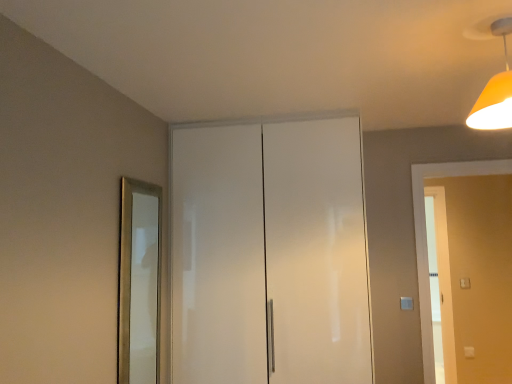
Describe the element at coordinates (269, 253) in the screenshot. Image resolution: width=512 pixels, height=384 pixels. I see `white glossy cabinet at center` at that location.

Image resolution: width=512 pixels, height=384 pixels. What are the coordinates of `white glossy door at right` in the screenshot? It's located at (426, 237).

Where is `orange matte light fixture at upper right`? The height and width of the screenshot is (384, 512). orange matte light fixture at upper right is located at coordinates (495, 90).

Is orange matte light fixture at upper right spatially inside white glossy cabinet at center, or outside of it?

orange matte light fixture at upper right is spatially situated outside white glossy cabinet at center.

Is orange matte light fixture at upper right placed right next to white glossy cabinet at center?

orange matte light fixture at upper right and white glossy cabinet at center are not in contact.

Does point (505, 59) appear closer or farther from the camera than point (187, 318)?

Point (505, 59) appears to be closer to the viewer than point (187, 318).

From a real-world perspective, relative to orange matte light fixture at upper right, is white glossy cabinet at center vertically above or below?

white glossy cabinet at center is below orange matte light fixture at upper right.

In the scene shown: Is white glossy cabinet at center not inside orange matte light fixture at upper right?

white glossy cabinet at center is positioned outside orange matte light fixture at upper right.

Can you confirm if white glossy cabinet at center is positioned to the left of orange matte light fixture at upper right?

Yes, white glossy cabinet at center is to the left of orange matte light fixture at upper right.

Is white glossy cabinet at center turned away from gold metallic mirror at left?

No, white glossy cabinet at center is not facing the opposite direction of gold metallic mirror at left.

Which of these two, white glossy cabinet at center or gold metallic mirror at left, is wider?

white glossy cabinet at center is wider.

Which is correct: white glossy cabinet at center is inside gold metallic mirror at left, or outside of it?

white glossy cabinet at center cannot be found inside gold metallic mirror at left.

Is point (497, 81) positioned before point (452, 173)?

Yes, point (497, 81) is closer to viewer.

Which is more to the left, orange matte light fixture at upper right or white glossy door at right?

orange matte light fixture at upper right is more to the left.

From a real-world perspective, between orange matte light fixture at upper right and white glossy door at right, who is vertically lower?

white glossy door at right, from a real-world perspective.

From the image's perspective, between orange matte light fixture at upper right and white glossy door at right, which one is located above?

orange matte light fixture at upper right, from the image's perspective.

Would you consider white glossy cabinet at center to be distant from white glossy door at right?

Yes, white glossy cabinet at center is far from white glossy door at right.

From the image's perspective, is white glossy cabinet at center located above or below white glossy door at right?

white glossy cabinet at center is situated higher than white glossy door at right in the image.

Would you say white glossy cabinet at center is inside or outside white glossy door at right?

A: white glossy cabinet at center cannot be found inside white glossy door at right.

Considering the sizes of objects orange matte light fixture at upper right and gold metallic mirror at left in the image provided, who is bigger, orange matte light fixture at upper right or gold metallic mirror at left?

Bigger between the two is gold metallic mirror at left.

Considering the relative sizes of orange matte light fixture at upper right and gold metallic mirror at left in the image provided, is orange matte light fixture at upper right thinner than gold metallic mirror at left?

Incorrect, the width of orange matte light fixture at upper right is not less than that of gold metallic mirror at left.

From a real-world perspective, is orange matte light fixture at upper right physically located above or below gold metallic mirror at left?

From a real-world perspective, orange matte light fixture at upper right is physically above gold metallic mirror at left.

Which point is more forward, [490,126] or [147,191]?

The point [490,126] is closer to the camera.

Which is closer, (155, 203) or (203, 366)?

Point (203, 366)

Considering the sizes of objects gold metallic mirror at left and white glossy cabinet at center in the image provided, who is thinner, gold metallic mirror at left or white glossy cabinet at center?

gold metallic mirror at left.

Is there a large distance between gold metallic mirror at left and white glossy cabinet at center?

gold metallic mirror at left is near white glossy cabinet at center, not far away.

The height and width of the screenshot is (384, 512). Find the location of `dresser on the right of gold metallic mirror at left`. dresser on the right of gold metallic mirror at left is located at coordinates (269, 253).

The width and height of the screenshot is (512, 384). In order to click on light fixture above the white glossy cabinet at center (from a real-world perspective) in this screenshot , I will do `click(495, 90)`.

Image resolution: width=512 pixels, height=384 pixels. In order to click on dresser that appears behind the orange matte light fixture at upper right in this screenshot , I will do `click(269, 253)`.

Based on their spatial positions, is gold metallic mirror at left or white glossy door at right further from white glossy cabinet at center?

Among the two, white glossy door at right is located further to white glossy cabinet at center.

Looking at the image, which one is located closer to orange matte light fixture at upper right, white glossy door at right or gold metallic mirror at left?

white glossy door at right is positioned closer to the anchor orange matte light fixture at upper right.

From the image, which object appears to be farther from orange matte light fixture at upper right, white glossy cabinet at center or gold metallic mirror at left?

Among the two, gold metallic mirror at left is located further to orange matte light fixture at upper right.

Estimate the real-world distances between objects in this image. Which object is closer to orange matte light fixture at upper right, gold metallic mirror at left or white glossy door at right?

white glossy door at right is positioned closer to the anchor orange matte light fixture at upper right.

Which object lies nearer to the anchor point white glossy cabinet at center, white glossy door at right or gold metallic mirror at left?

Based on the image, gold metallic mirror at left appears to be nearer to white glossy cabinet at center.

From the image, which object appears to be farther from orange matte light fixture at upper right, white glossy cabinet at center or white glossy door at right?

white glossy door at right is further to orange matte light fixture at upper right.

Considering their positions, is orange matte light fixture at upper right positioned further to white glossy door at right than gold metallic mirror at left?

Based on the image, gold metallic mirror at left appears to be further to white glossy door at right.

Considering their positions, is white glossy door at right positioned closer to gold metallic mirror at left than white glossy cabinet at center?

The object closer to gold metallic mirror at left is white glossy cabinet at center.

This screenshot has width=512, height=384. What are the coordinates of `dresser situated between gold metallic mirror at left and white glossy door at right from left to right` in the screenshot? It's located at (269, 253).

I want to click on dresser positioned between orange matte light fixture at upper right and white glossy door at right from near to far, so click(x=269, y=253).

You are a GUI agent. You are given a task and a screenshot of the screen. Output one action in this format:
    pyautogui.click(x=<x>, y=<y>)
    Task: Click on the dresser between gold metallic mirror at left and orange matte light fixture at upper right
    The width and height of the screenshot is (512, 384).
    Given the screenshot: What is the action you would take?
    pyautogui.click(x=269, y=253)

This screenshot has height=384, width=512. Find the location of `light fixture located between gold metallic mirror at left and white glossy door at right in the left-right direction`. light fixture located between gold metallic mirror at left and white glossy door at right in the left-right direction is located at coordinates (495, 90).